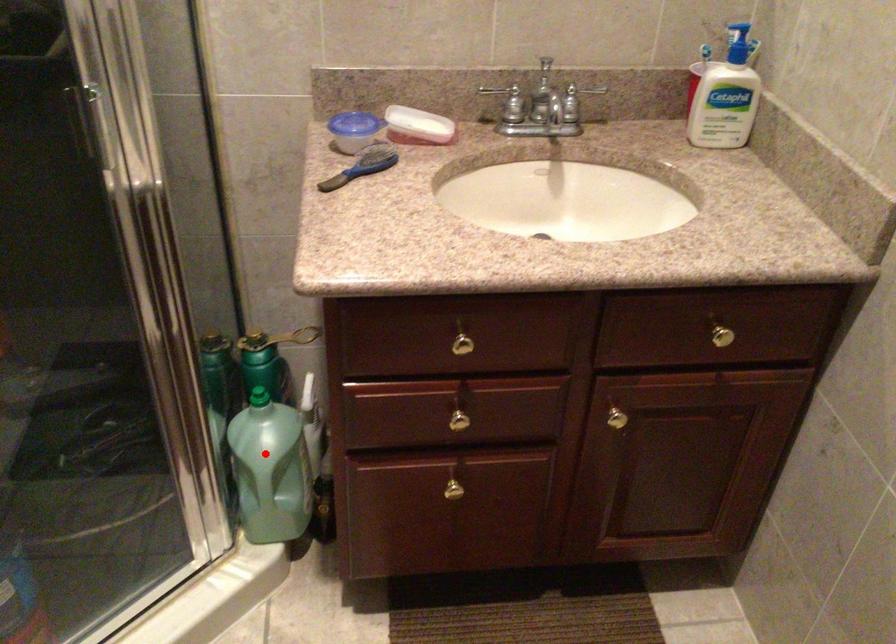
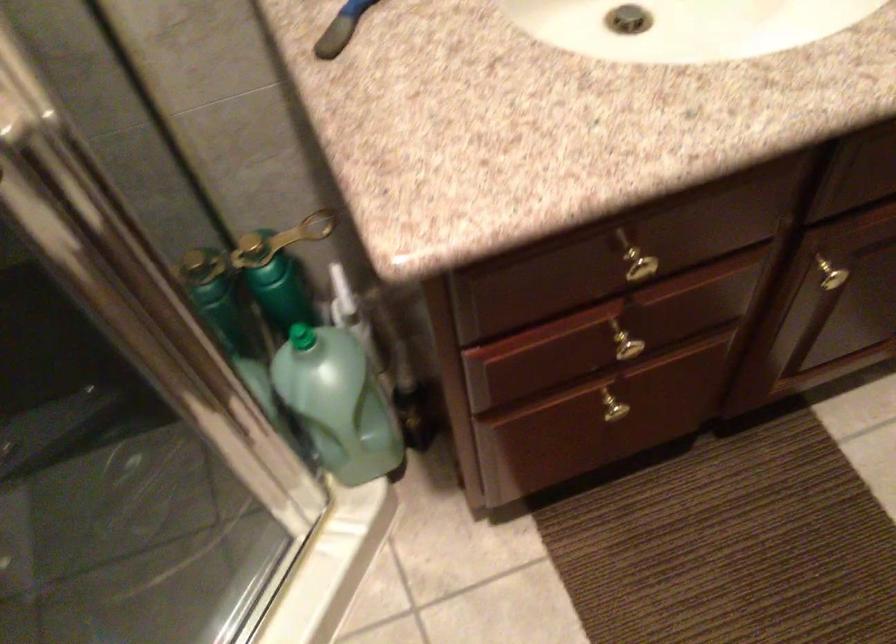
Where in the second image is the point corresponding to the highlighted location from the first image?

(338, 402)